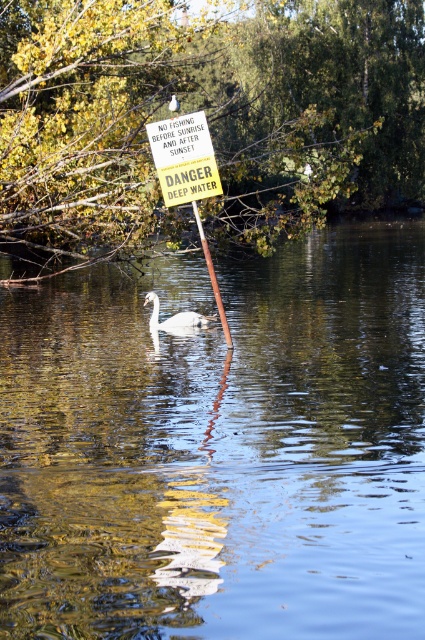
You are a GUI agent. You are given a task and a screenshot of the screen. Output one action in this format:
    pyautogui.click(x=<x>, y=<y>)
    Task: Click on the clear water at center
    This screenshot has width=425, height=640.
    Given the screenshot: What is the action you would take?
    pyautogui.click(x=218, y=448)

What do you see at coordinates (218, 448) in the screenshot? I see `clear water at center` at bounding box center [218, 448].

Image resolution: width=425 pixels, height=640 pixels. What do you see at coordinates (218, 448) in the screenshot?
I see `clear water at center` at bounding box center [218, 448].

Locate an element on the screen. The image size is (425, 640). clear water at center is located at coordinates (218, 448).

Between yellow paper sign at center and wooden pole at center, which one appears on the left side from the viewer's perspective?

From the viewer's perspective, yellow paper sign at center appears more on the left side.

Where is `yellow paper sign at center`? The height and width of the screenshot is (640, 425). yellow paper sign at center is located at coordinates (184, 157).

What are the coordinates of `yellow paper sign at center` in the screenshot? It's located at (184, 157).

Is clear water at center thinner than yellow paper sign at center?

No.

Between clear water at center and yellow paper sign at center, which one is positioned higher?

yellow paper sign at center is above.

Does point (82, 461) lie in front of point (169, 141)?

Yes.

You are a GUI agent. You are given a task and a screenshot of the screen. Output one action in this format:
    pyautogui.click(x=<x>, y=<y>)
    Task: Click on the clear water at center
    This screenshot has height=640, width=425.
    Given the screenshot: What is the action you would take?
    pyautogui.click(x=218, y=448)